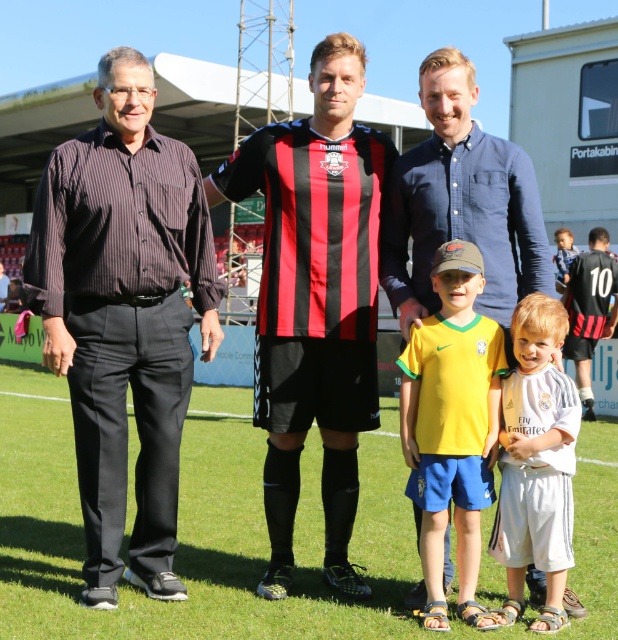
Question: Does green grass football field at center have a lesser width compared to red and black striped jersey at center?

Choices:
 (A) yes
 (B) no

Answer: (B)

Question: Does red and black striped jersey at center have a greater width compared to white cotton shirt at center?

Choices:
 (A) no
 (B) yes

Answer: (B)

Question: Among these objects, which one is farthest from the camera?

Choices:
 (A) yellow jersey at center
 (B) red and black striped jersey at center

Answer: (B)

Question: Which point is farther to the camera?

Choices:
 (A) black jersey at right
 (B) yellow jersey at center

Answer: (A)

Question: Which object is farther from the camera taking this photo?

Choices:
 (A) red and black striped jersey at center
 (B) black jersey at right
 (C) yellow jersey at center

Answer: (B)

Question: Is green grass football field at center closer to the viewer compared to white cotton shirt at center?

Choices:
 (A) yes
 (B) no

Answer: (A)